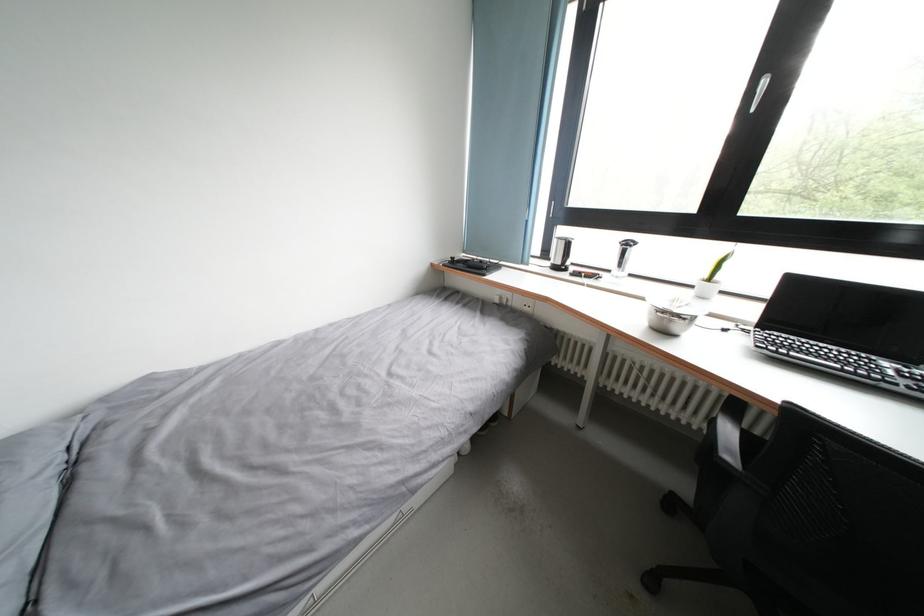
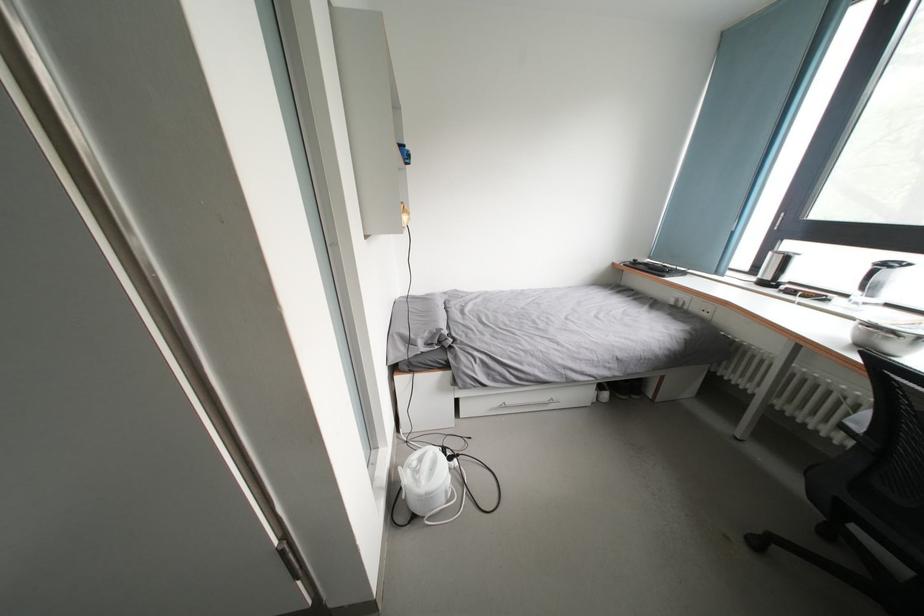
Where in the second image is the point corresponding to (565,267) from the first image?

(774, 283)